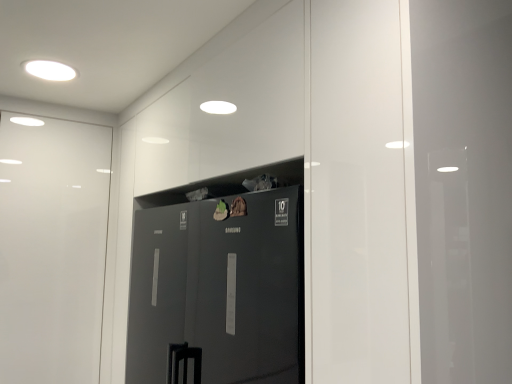
Question: Considering the positions of glossy black refrigerator at center and white glossy light fixture at upper left in the image, is glossy black refrigerator at center taller or shorter than white glossy light fixture at upper left?

Choices:
 (A) tall
 (B) short

Answer: (A)

Question: Visually, is glossy black refrigerator at center positioned to the left or to the right of white glossy light fixture at upper left?

Choices:
 (A) left
 (B) right

Answer: (B)

Question: Is glossy black refrigerator at center wider or thinner than white glossy light fixture at upper left?

Choices:
 (A) wide
 (B) thin

Answer: (A)

Question: From a real-world perspective, is white glossy light fixture at upper left above or below glossy black refrigerator at center?

Choices:
 (A) above
 (B) below

Answer: (A)

Question: Is white glossy light fixture at upper left wider or thinner than glossy black refrigerator at center?

Choices:
 (A) thin
 (B) wide

Answer: (A)

Question: In the image, is white glossy light fixture at upper left positioned in front of or behind glossy black refrigerator at center?

Choices:
 (A) behind
 (B) front

Answer: (A)

Question: From the image's perspective, is white glossy light fixture at upper left positioned above or below glossy black refrigerator at center?

Choices:
 (A) above
 (B) below

Answer: (A)